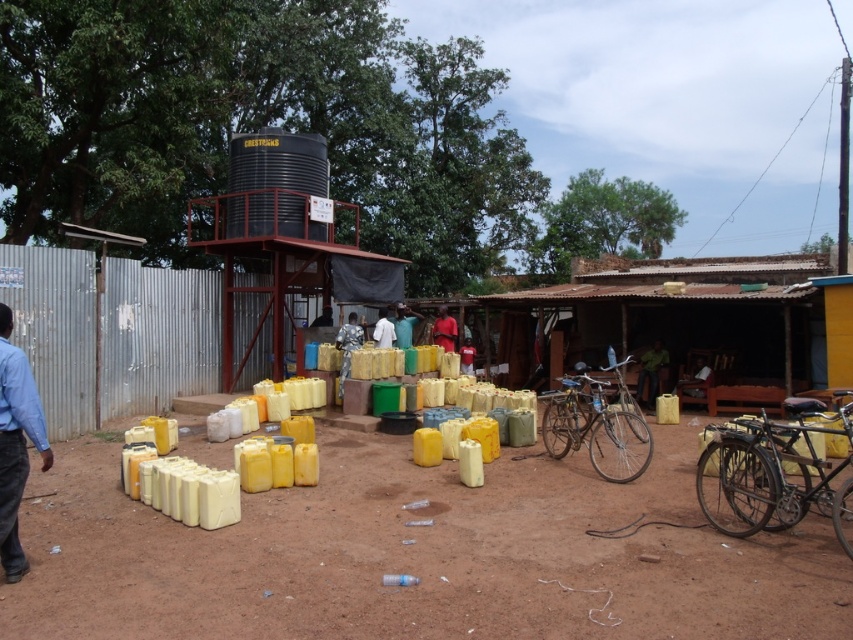
Question: Does blue shirt at left appear over white matte shirt at center?

Choices:
 (A) no
 (B) yes

Answer: (A)

Question: Among these points, which one is nearest to the camera?

Choices:
 (A) (349, 349)
 (B) (442, 324)
 (C) (387, 342)

Answer: (A)

Question: Does brown dirt field at center appear on the left side of white matte shirt at center?

Choices:
 (A) yes
 (B) no

Answer: (B)

Question: Which object is closer to the camera taking this photo?

Choices:
 (A) blue fabric at center
 (B) blue shirt at left
 (C) brown dirt field at center
 (D) matte red shirt at center

Answer: (B)

Question: Which of the following is the farthest from the observer?

Choices:
 (A) white matte shirt at center
 (B) brown dirt field at center
 (C) camouflage fabric person at center

Answer: (A)

Question: Is camouflage fabric person at center wider than blue fabric at center?

Choices:
 (A) no
 (B) yes

Answer: (A)